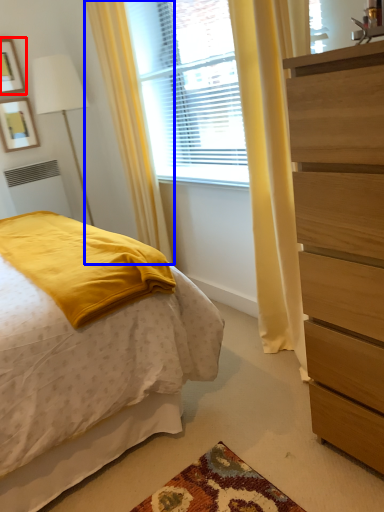
Question: Which object is further to the camera taking this photo, picture frame (highlighted by a red box) or curtain (highlighted by a blue box)?

Choices:
 (A) picture frame
 (B) curtain

Answer: (A)